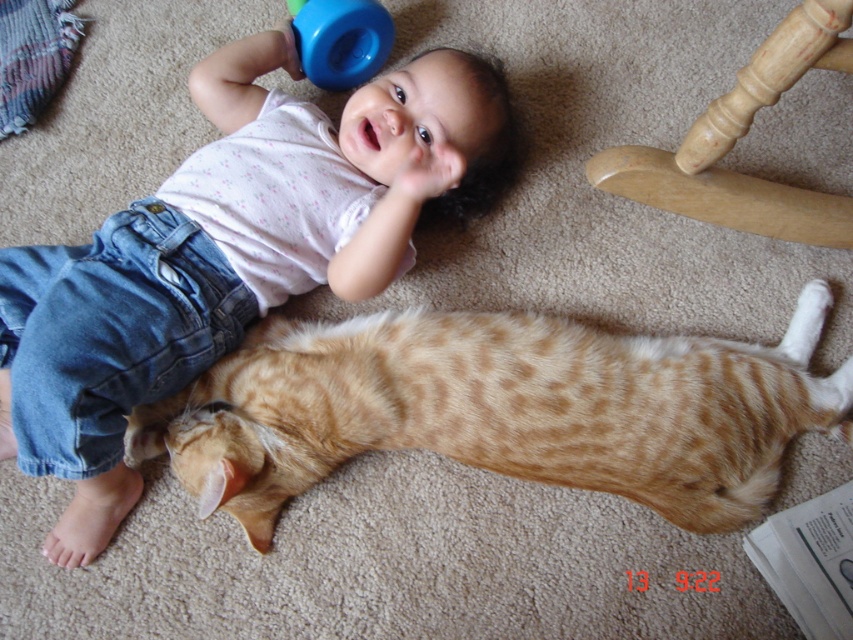
Question: Estimate the real-world distances between objects in this image. Which object is closer to the matte white shirt at upper center?

Choices:
 (A) light wood rocking chair at upper right
 (B) orange tabby cat at lower center

Answer: (B)

Question: In this image, where is matte white shirt at upper center located relative to blue rubber sippy cup at upper center?

Choices:
 (A) right
 (B) left

Answer: (B)

Question: Does orange tabby cat at lower center have a greater width compared to blue rubber sippy cup at upper center?

Choices:
 (A) no
 (B) yes

Answer: (B)

Question: Which object appears farthest from the camera in this image?

Choices:
 (A) light wood rocking chair at upper right
 (B) matte white shirt at upper center

Answer: (B)

Question: Among these points, which one is nearest to the camera?

Choices:
 (A) (308, 52)
 (B) (216, 228)
 (C) (848, 224)
 (D) (822, 390)

Answer: (D)

Question: Is matte white shirt at upper center positioned before orange tabby cat at lower center?

Choices:
 (A) no
 (B) yes

Answer: (B)